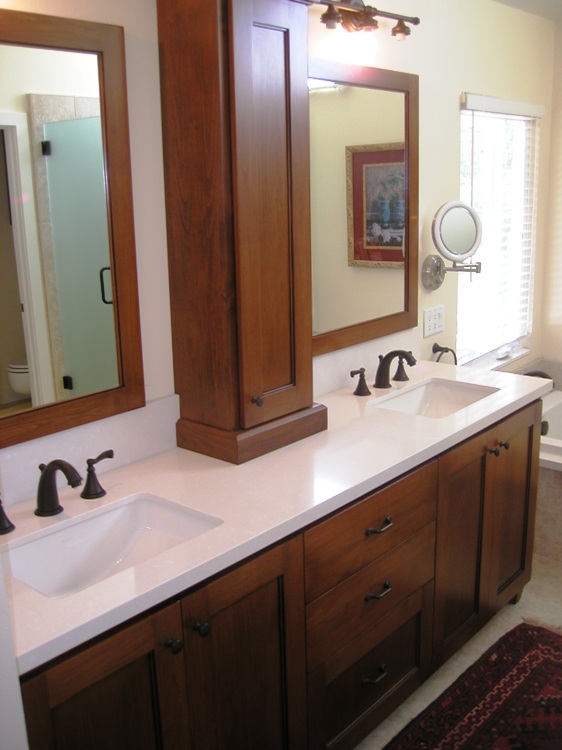
Find the location of a particular element. door knobs is located at coordinates (259, 400), (496, 454), (510, 442), (180, 646), (207, 632).